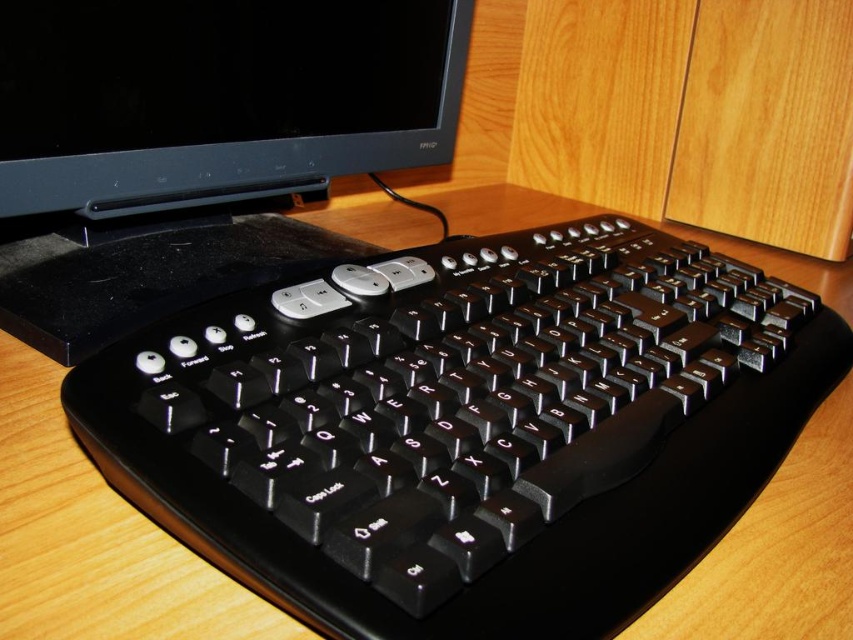
Question: Which of the following is the farthest from the observer?

Choices:
 (A) (22, 364)
 (B) (22, 289)

Answer: (B)

Question: Which of the following is the farthest from the observer?

Choices:
 (A) black plastic monitor at upper center
 (B) wooden computer desk at center

Answer: (B)

Question: Is black plastic monitor at upper center wider than wooden computer desk at center?

Choices:
 (A) no
 (B) yes

Answer: (A)

Question: Is black plastic monitor at upper center wider than wooden computer desk at center?

Choices:
 (A) yes
 (B) no

Answer: (B)

Question: Does black plastic monitor at upper center come in front of wooden computer desk at center?

Choices:
 (A) no
 (B) yes

Answer: (B)